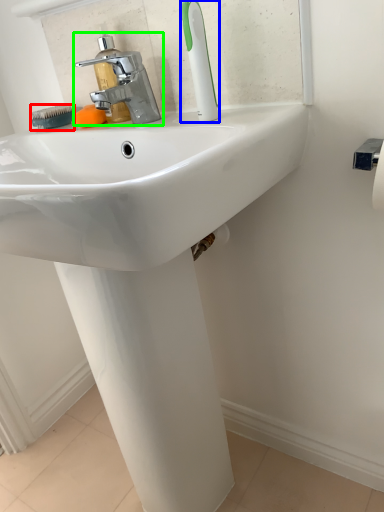
Question: Based on their relative distances, which object is farther from brush (highlighted by a red box)? Choose from toothbrush (highlighted by a blue box) and tap (highlighted by a green box).

Choices:
 (A) toothbrush
 (B) tap

Answer: (A)